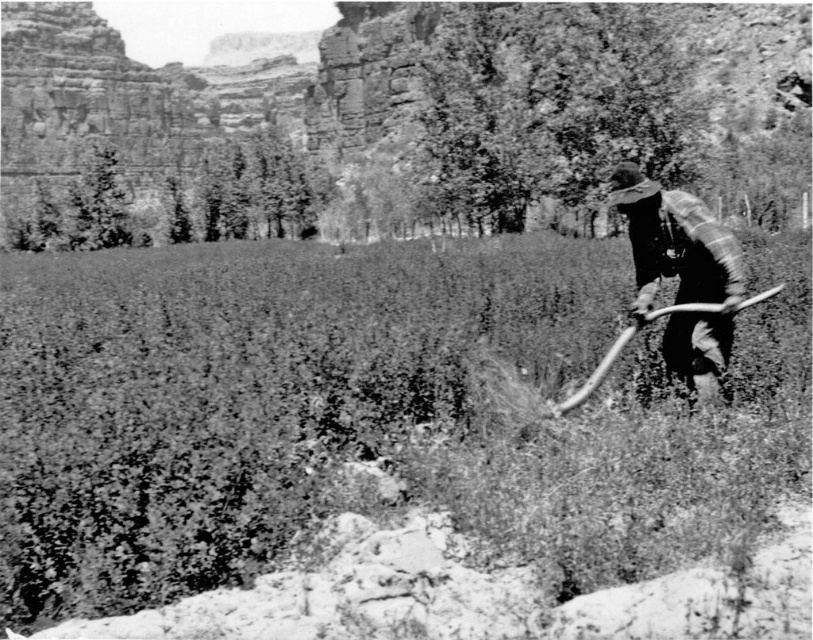
You are an observer in the scene. You notice the coarse textured grass at center and the plaid fabric shirt at right. Which object is nearer to you?

The coarse textured grass at center is closer to the viewer than the plaid fabric shirt at right.

You are a photographer trying to capture the coarse textured grass at center in your shot. Based on the scene, where should you position your camera relative to the rocky outcrop and the person?

The coarse textured grass at center is located at coordinates point (333, 413), so you should position your camera in the midground area between the rocky outcrop and the background to capture the coarse textured grass at center effectively.

You are standing at the point labeled point (x=520, y=497) and want to walk to the point labeled point (x=633, y=195). Which direction should you move to get closer to your destination?

You should move towards the upper right direction because point (x=633, y=195) is further away from the viewer compared to point (x=520, y=497).